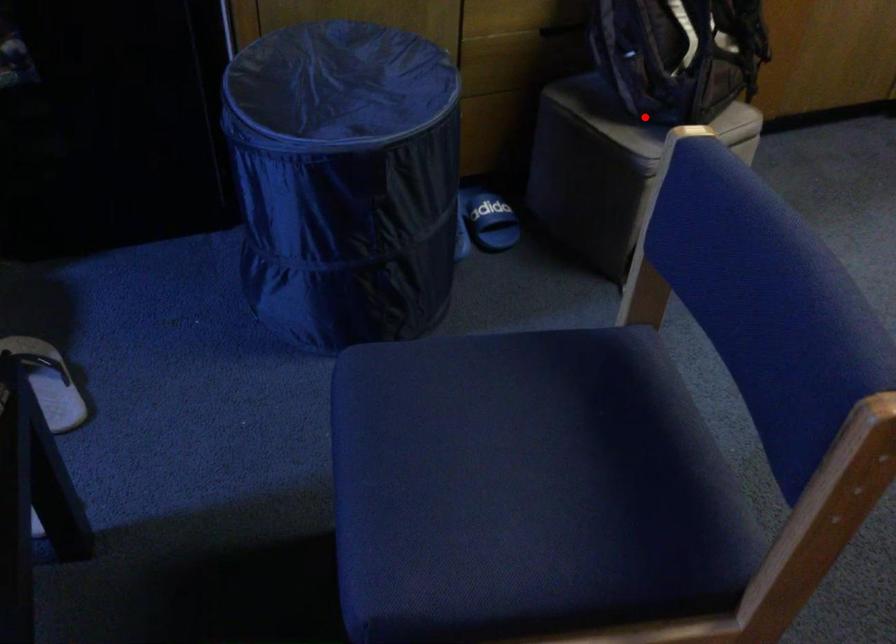
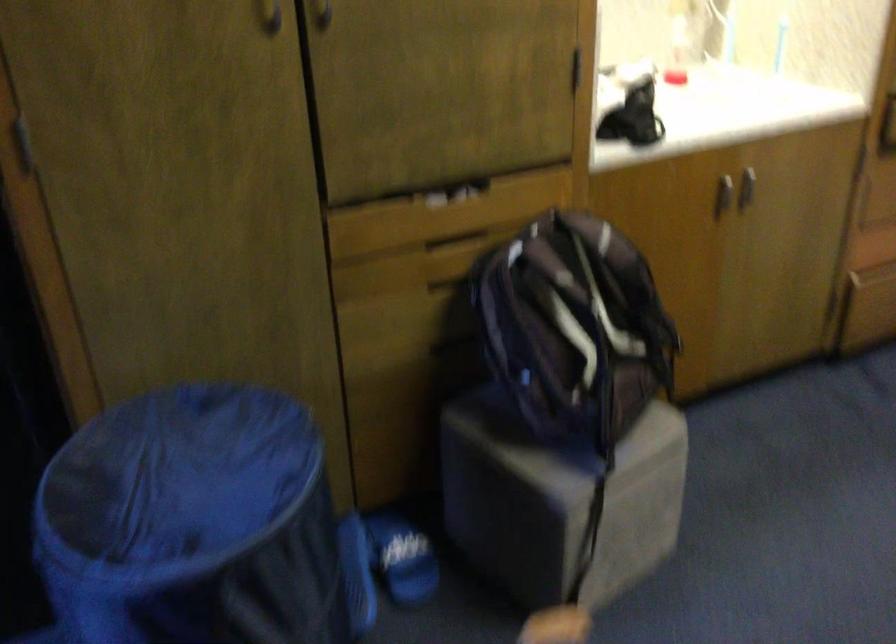
Where in the second image is the point corresponding to the highlighted location from the first image?

(556, 442)